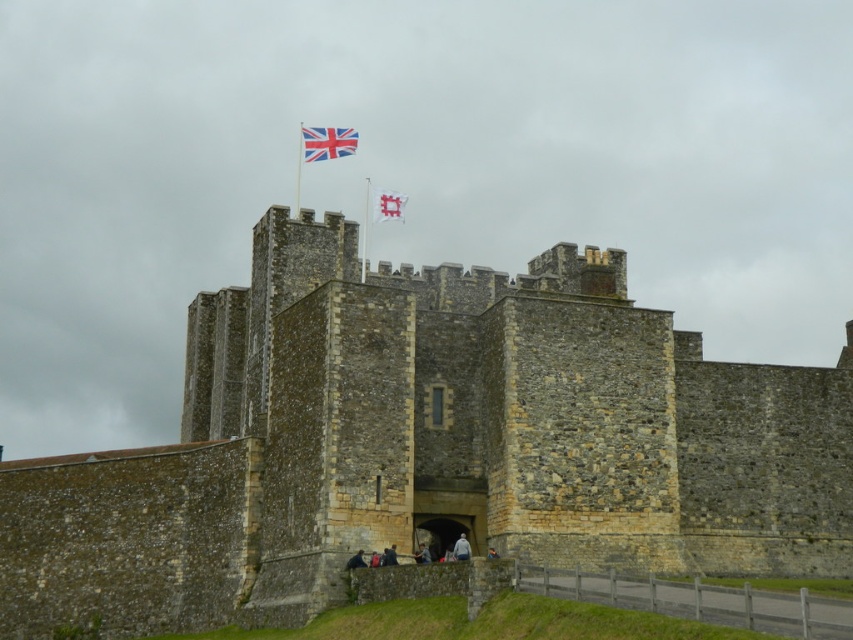
Question: Which of the following is the closest to the observer?

Choices:
 (A) (320, 296)
 (B) (393, 218)

Answer: (A)

Question: Which object appears closest to the camera in this image?

Choices:
 (A) stone wall at center
 (B) white fabric flag at upper center

Answer: (A)

Question: Estimate the real-world distances between objects in this image. Which object is closer to the stone wall at center?

Choices:
 (A) british flag at top center
 (B) white fabric flag at upper center

Answer: (A)

Question: Is stone wall at center thinner than british flag at top center?

Choices:
 (A) yes
 (B) no

Answer: (B)

Question: From the image, what is the correct spatial relationship of british flag at top center in relation to white fabric flag at upper center?

Choices:
 (A) right
 (B) left

Answer: (B)

Question: Can you confirm if british flag at top center is positioned above white fabric flag at upper center?

Choices:
 (A) yes
 (B) no

Answer: (A)